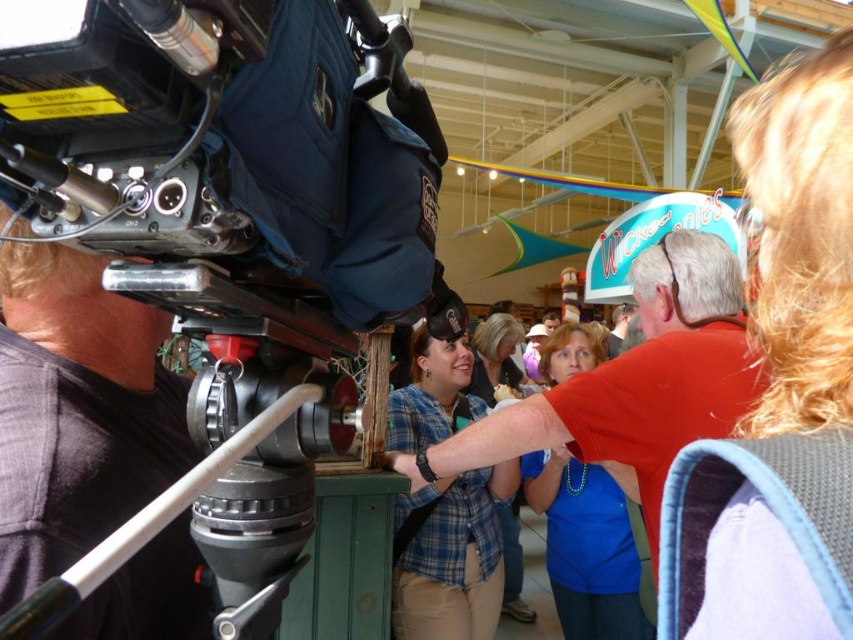
Question: Can you confirm if blonde hair at upper right is positioned above white plastic tripod at center?

Choices:
 (A) no
 (B) yes

Answer: (B)

Question: Can you confirm if blonde hair at upper right is wider than plaid shirt at center?

Choices:
 (A) yes
 (B) no

Answer: (A)

Question: Which point appears farthest from the camera in this image?

Choices:
 (A) (578, 620)
 (B) (804, 202)
 (C) (534, 416)
 (D) (463, 356)

Answer: (D)

Question: Is white plastic tripod at center smaller than plaid shirt at center?

Choices:
 (A) no
 (B) yes

Answer: (B)

Question: Estimate the real-world distances between objects in this image. Which object is farther from the blue plaid shirt at center?

Choices:
 (A) metallic black video camera at upper left
 (B) blue fabric shirt at center
 (C) red shirt at center

Answer: (A)

Question: Which is farther from the red shirt at center?

Choices:
 (A) blue fabric shirt at center
 (B) metallic black video camera at upper left

Answer: (B)